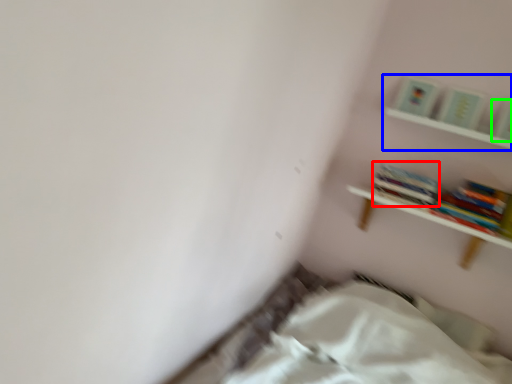
Question: Which object is the closest to the book (highlighted by a red box)? Choose among these: shelf (highlighted by a blue box) or paperback book (highlighted by a green box).

Choices:
 (A) shelf
 (B) paperback book

Answer: (A)